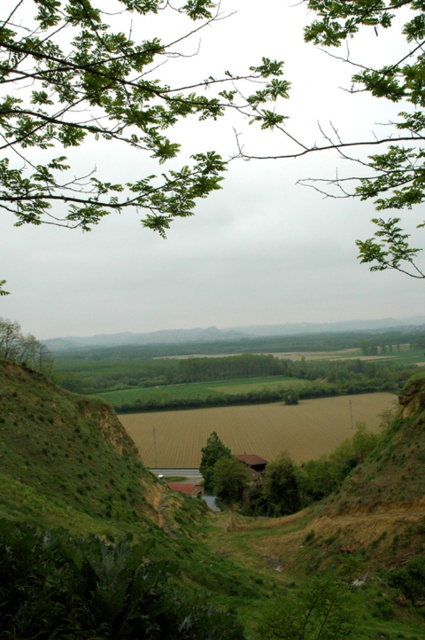
Question: Which of the following is the closest to the observer?

Choices:
 (A) green matte tree at center
 (B) green leafy tree at left

Answer: (B)

Question: Can you confirm if green leafy tree at left is smaller than green matte tree at center?

Choices:
 (A) yes
 (B) no

Answer: (B)

Question: Is the position of green leafy tree at left more distant than that of green matte tree at center?

Choices:
 (A) no
 (B) yes

Answer: (A)

Question: Is green leafy tree at left to the right of green matte tree at center from the viewer's perspective?

Choices:
 (A) no
 (B) yes

Answer: (A)